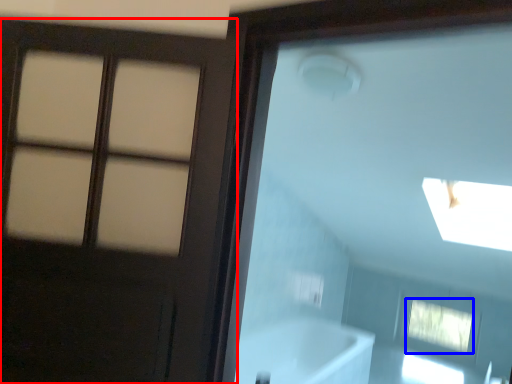
Question: Which of the following is the farthest to the observer, door (highlighted by a red box) or window (highlighted by a blue box)?

Choices:
 (A) door
 (B) window

Answer: (B)